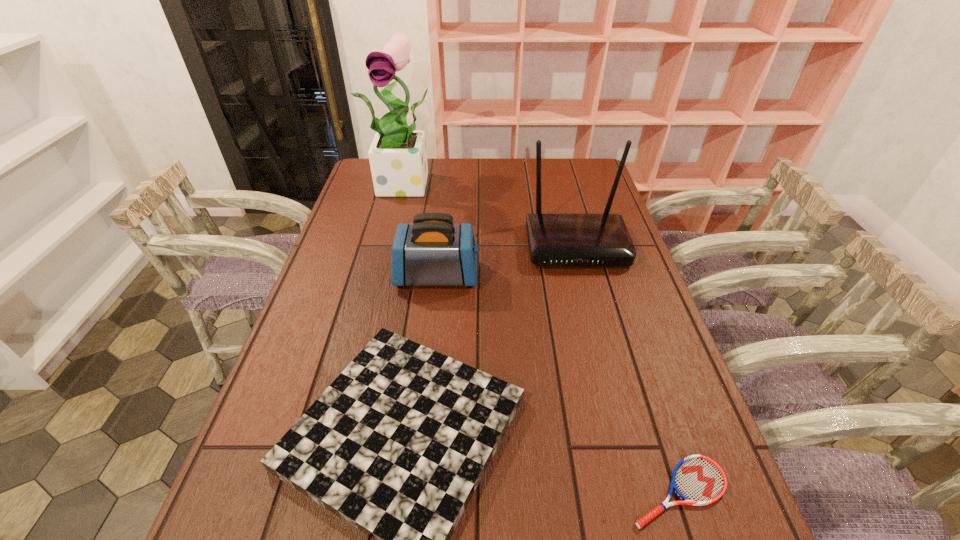
Find the location of a particular element. This screenshot has height=540, width=960. the tallest object is located at coordinates (398, 159).

I want to click on the farthest object, so click(398, 159).

You are a GUI agent. You are given a task and a screenshot of the screen. Output one action in this format:
    pyautogui.click(x=<x>, y=<y>)
    Task: Click on the second tallest object
    
    Given the screenshot: What is the action you would take?
    pyautogui.click(x=555, y=240)

The image size is (960, 540). I want to click on toaster, so click(432, 251).

Image resolution: width=960 pixels, height=540 pixels. In order to click on tennis racket in this screenshot , I will do tap(698, 480).

Where is `vacant space located 0.340m on the front-facing side of the farthest object`? The width and height of the screenshot is (960, 540). vacant space located 0.340m on the front-facing side of the farthest object is located at coordinates (389, 267).

Locate an element on the screen. The image size is (960, 540). vacant space situated 0.360m on the front-facing side of the second tallest object is located at coordinates (611, 376).

Where is `free space located on the front-facing side of the toaster`? This screenshot has width=960, height=540. free space located on the front-facing side of the toaster is located at coordinates (601, 276).

Find the location of a particular element. The image size is (960, 540). vacant space located 0.390m on the left of the tennis racket is located at coordinates (414, 492).

I want to click on object that is at the far edge, so click(398, 159).